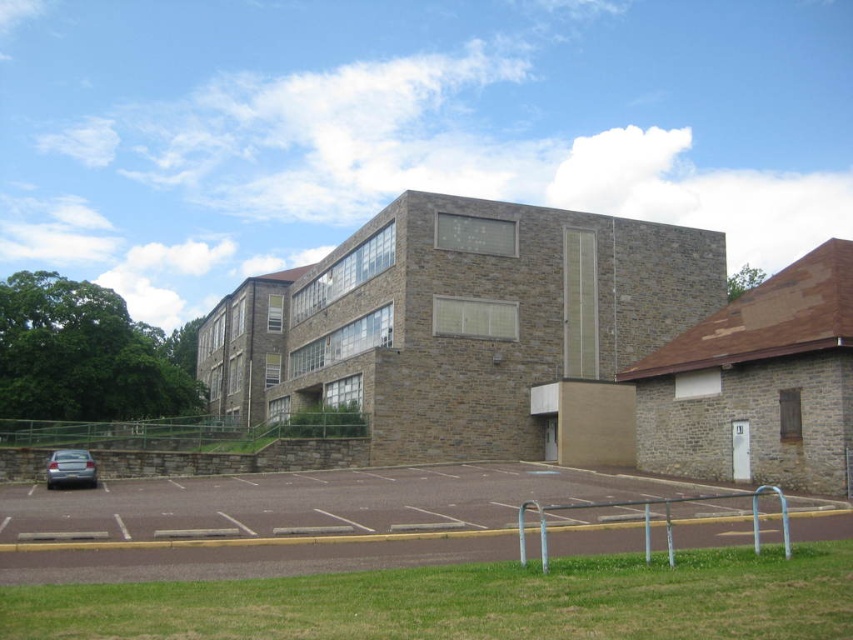
Question: Among these points, which one is nearest to the camera?

Choices:
 (A) (422, 524)
 (B) (64, 474)

Answer: (A)

Question: Does brown asphalt parking lot at lower center lie behind satin silver sedan at lower left?

Choices:
 (A) yes
 (B) no

Answer: (B)

Question: Is brown asphalt parking lot at lower center above satin silver sedan at lower left?

Choices:
 (A) no
 (B) yes

Answer: (B)

Question: Which point appears closest to the camera in this image?

Choices:
 (A) (82, 470)
 (B) (616, 483)

Answer: (B)

Question: Does brown asphalt parking lot at lower center have a smaller size compared to satin silver sedan at lower left?

Choices:
 (A) yes
 (B) no

Answer: (B)